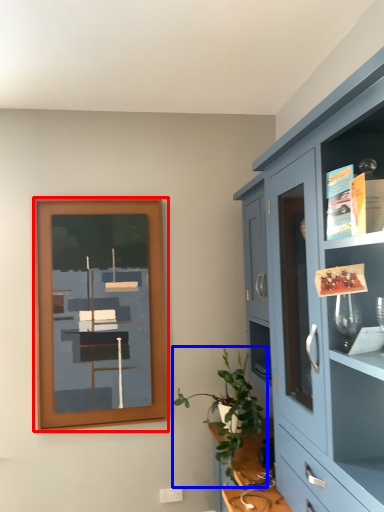
Question: Which of the following is the farthest to the observer, picture frame (highlighted by a red box) or houseplant (highlighted by a blue box)?

Choices:
 (A) picture frame
 (B) houseplant

Answer: (A)